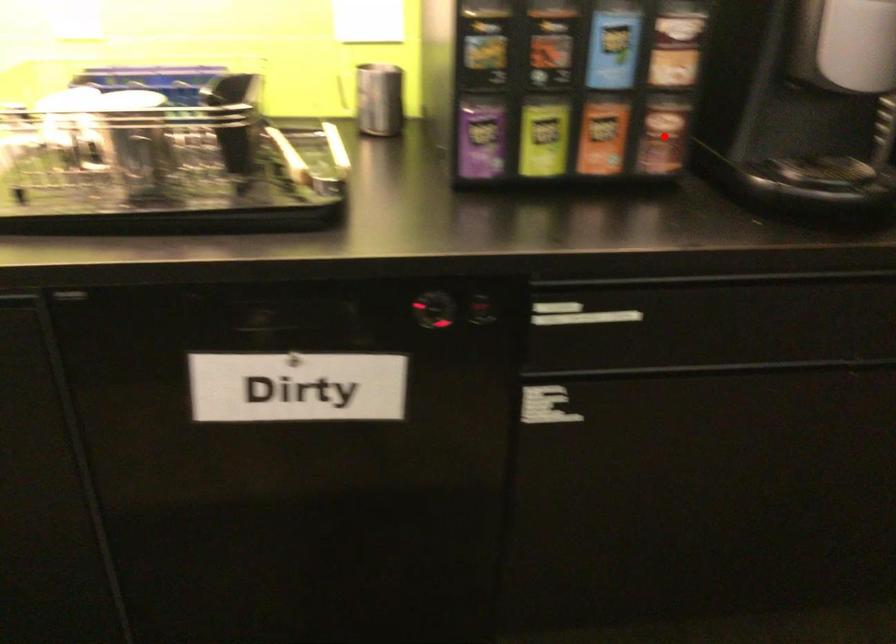
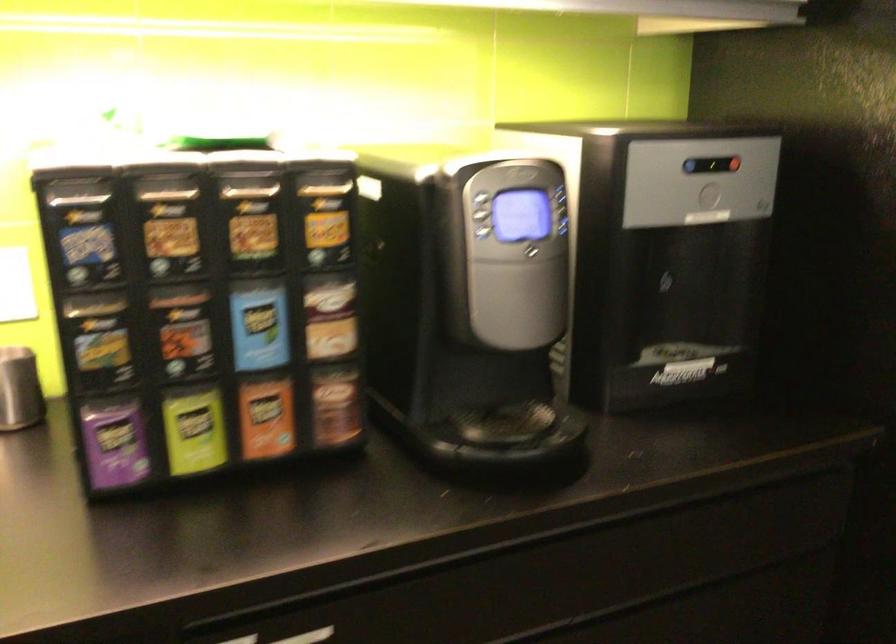
Question: I am providing you with two images of the same scene from different viewpoints. In image1, a red point is highlighted. Considering the same 3D point in image2, which of the following is correct?

Choices:
 (A) It is closer
 (B) It is farther

Answer: (A)